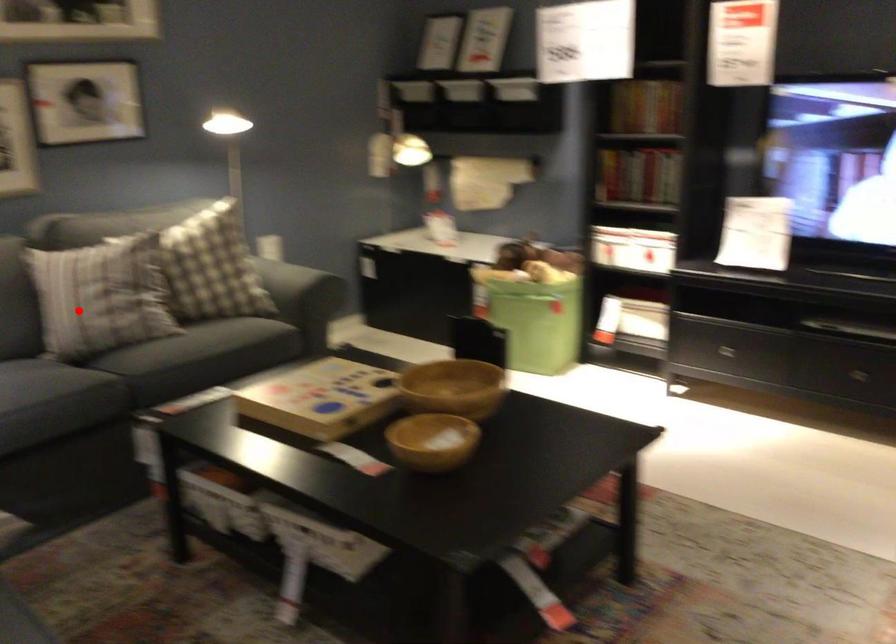
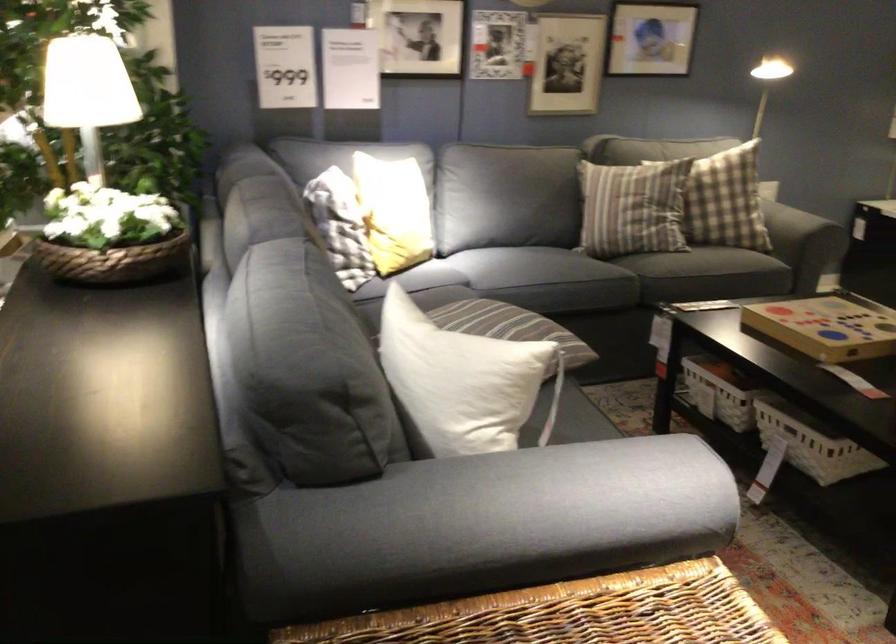
Question: I am providing you with two images of the same scene from different viewpoints. A red point is shown in image1. For the corresponding object point in image2, is it positioned nearer or farther from the camera?

Choices:
 (A) Nearer
 (B) Farther

Answer: (B)